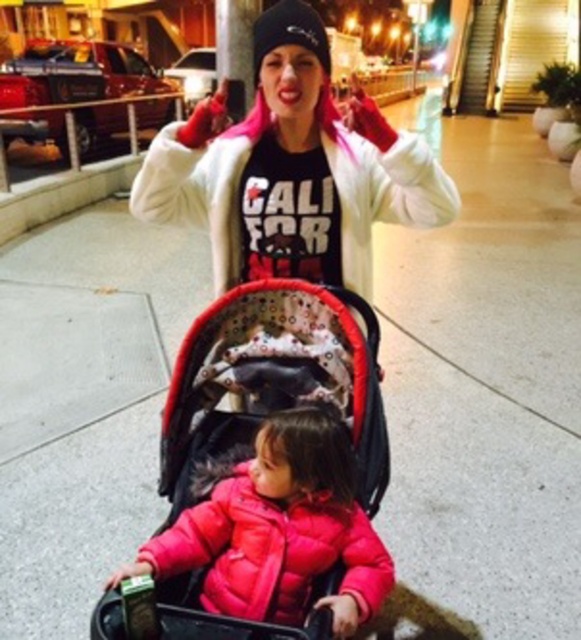
Question: Can you confirm if matte white coat at center is bigger than red fabric baby carriage at center?

Choices:
 (A) no
 (B) yes

Answer: (A)

Question: Does matte white coat at center have a larger size compared to red fabric baby carriage at center?

Choices:
 (A) yes
 (B) no

Answer: (B)

Question: Which of these objects is positioned farthest from the matte white coat at center?

Choices:
 (A) matte pink puffer jacket at center
 (B) red fabric baby carriage at center

Answer: (A)

Question: Is matte white coat at center to the left of red fabric baby carriage at center from the viewer's perspective?

Choices:
 (A) yes
 (B) no

Answer: (B)

Question: Which object is positioned farthest from the red fabric baby carriage at center?

Choices:
 (A) matte pink puffer jacket at center
 (B) matte white coat at center

Answer: (B)

Question: Which point is closer to the camera?

Choices:
 (A) (192, 557)
 (B) (252, 344)
 (C) (228, 250)

Answer: (A)